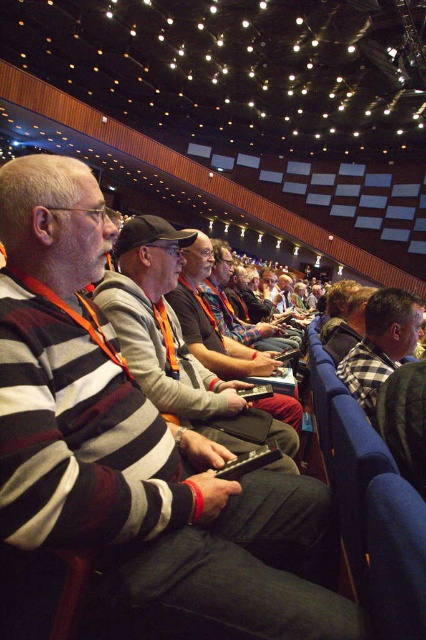
Question: Among these points, which one is nearest to the camera?

Choices:
 (A) (400, 310)
 (B) (184, 230)
 (C) (287, 346)

Answer: (B)

Question: Which of the following is the farthest from the observer?

Choices:
 (A) checkered fabric shirt at right
 (B) striped knit sweater at center
 (C) striped sweater at center

Answer: (C)

Question: Does striped knit sweater at center appear over striped sweater at center?

Choices:
 (A) no
 (B) yes

Answer: (A)

Question: Which is farther from the striped sweater at center?

Choices:
 (A) striped knit sweater at center
 (B) checkered fabric shirt at right
 (C) striped wool sweater at center

Answer: (C)

Question: Is checkered fabric shirt at right to the right of striped sweater at center from the viewer's perspective?

Choices:
 (A) yes
 (B) no

Answer: (A)

Question: Is striped wool sweater at center bigger than striped knit sweater at center?

Choices:
 (A) yes
 (B) no

Answer: (B)